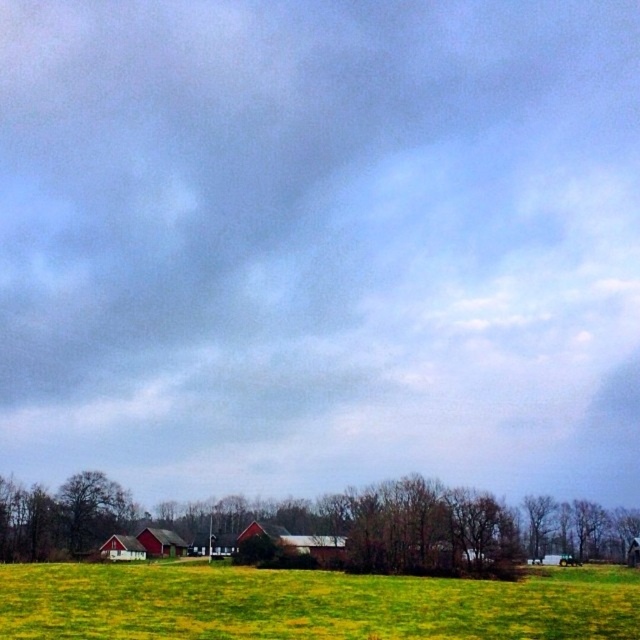
You are standing at point [308,604] in the image. Based on the scene description, what is the terrain like at your current location?

The terrain at point [308,604] is green grass pasture at lower center.

Looking at this image, you are a painter setting up an easel to capture the rural landscape. You want to ensure both the brown textured tree at lower center and the green leafy tree at lower right are visible in your painting. Based on their widths, which tree should you position closer to the center of your canvas to emphasize its presence?

The brown textured tree at lower center might be wider than the green leafy tree at lower right, so positioning it closer to the center of the canvas would emphasize its prominence due to its potentially larger width.

You are standing at the origin point of the image. Which direction should you move to reach the green grass pasture at lower center?

The green grass pasture at lower center is located at point 0.944 on the x axis and 0.483 on the y axis. Since the origin is at the bottom left corner of the image, you should move to the right and slightly upwards to reach it.